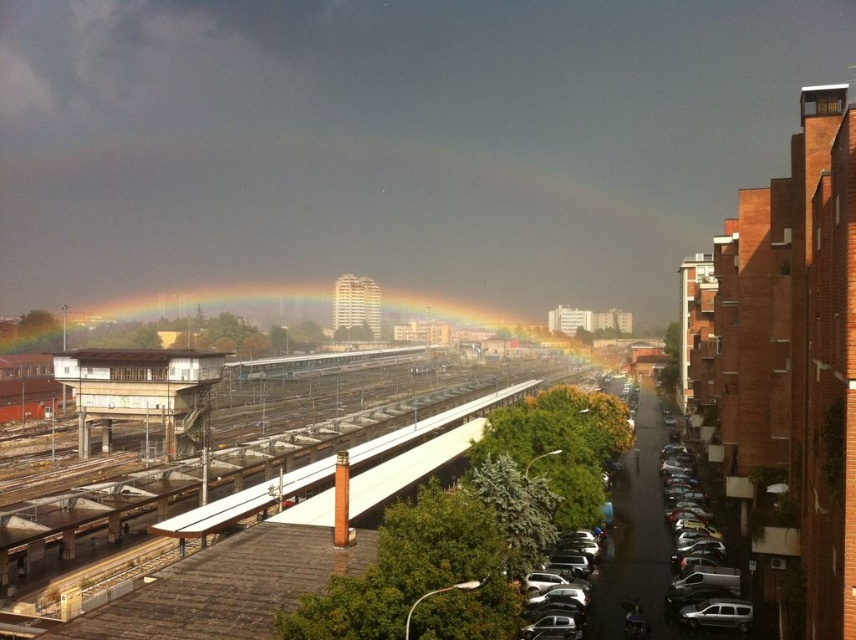
Question: Does brown wooden railway station at center-left have a larger size compared to metallic silver train at center?

Choices:
 (A) no
 (B) yes

Answer: (A)

Question: In this image, where is brown wooden railway station at center-left located relative to silver metallic car at lower right?

Choices:
 (A) left
 (B) right

Answer: (A)

Question: Which point is closer to the camera?

Choices:
 (A) click(x=393, y=358)
 (B) click(x=571, y=616)
 (C) click(x=84, y=444)

Answer: (B)

Question: Which point is closer to the camera taking this photo?

Choices:
 (A) (168, 369)
 (B) (369, 355)
 (C) (584, 618)

Answer: (C)

Question: Which point is farther from the camera taking this photo?

Choices:
 (A) (78, 420)
 (B) (265, 364)
 (C) (592, 548)

Answer: (B)

Question: Is brown wooden railway station at center-left positioned at the back of metallic silver train at center?

Choices:
 (A) no
 (B) yes

Answer: (A)